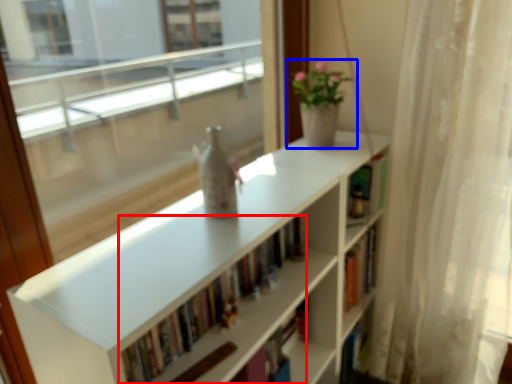
Question: Among these objects, which one is nearest to the camera, book (highlighted by a red box) or houseplant (highlighted by a blue box)?

Choices:
 (A) book
 (B) houseplant

Answer: (A)